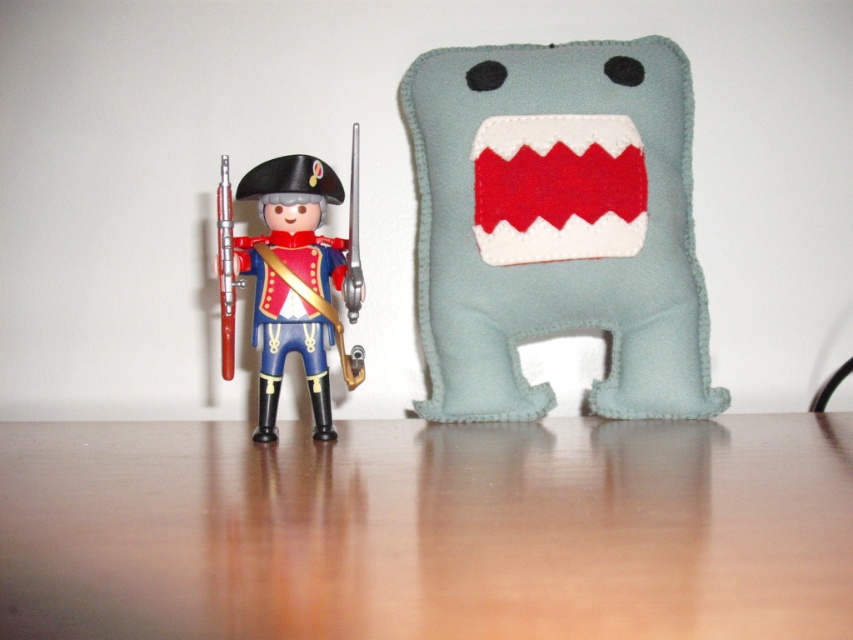
Based on the photo, can you confirm if wooden table at center is positioned above light blue felt plush at right?

Actually, wooden table at center is below light blue felt plush at right.

Based on the photo, between wooden table at center and light blue felt plush at right, which one has more height?

light blue felt plush at right is taller.

Where is `wooden table at center`? wooden table at center is located at coordinates (428, 529).

Which is more to the left, wooden table at center or shiny blue fabric uniform at left?

From the viewer's perspective, shiny blue fabric uniform at left appears more on the left side.

Is wooden table at center below shiny blue fabric uniform at left?

Yes.

Does point (546, 588) lie in front of point (334, 278)?

Yes.

Where is `wooden table at center`? The image size is (853, 640). wooden table at center is located at coordinates (428, 529).

From the picture: Between shiny plastic soldier at left and shiny blue fabric uniform at left, which one has more height?

Standing taller between the two is shiny plastic soldier at left.

Does shiny plastic soldier at left have a lesser height compared to shiny blue fabric uniform at left?

In fact, shiny plastic soldier at left may be taller than shiny blue fabric uniform at left.

Is point (227, 208) positioned in front of point (292, 316)?

Yes.

The image size is (853, 640). In order to click on shiny plastic soldier at left in this screenshot , I will do `click(292, 280)`.